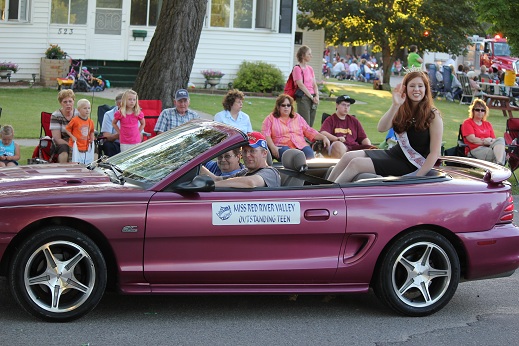
At what (x,y) coordinates should I click in order to perform the action: click on door to house. Please return your answer as a coordinate pair (x, y). This screenshot has height=346, width=519. Looking at the image, I should click on (109, 46).